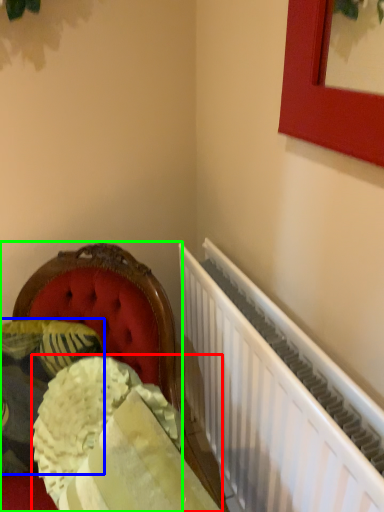
Question: Which object is the closest to the material (highlighted by a red box)? Choose among these: pillow (highlighted by a blue box) or furniture (highlighted by a green box).

Choices:
 (A) pillow
 (B) furniture

Answer: (A)